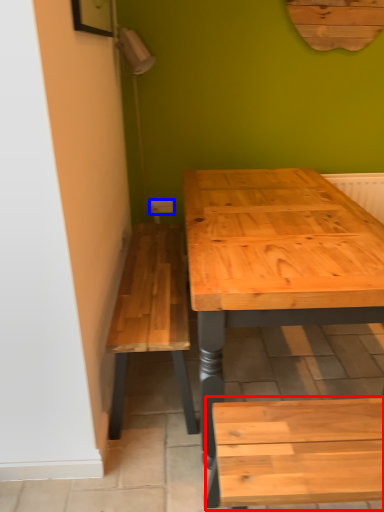
Question: Among these objects, which one is nearest to the camera, church bench (highlighted by a red box) or electric outlet (highlighted by a blue box)?

Choices:
 (A) church bench
 (B) electric outlet

Answer: (A)